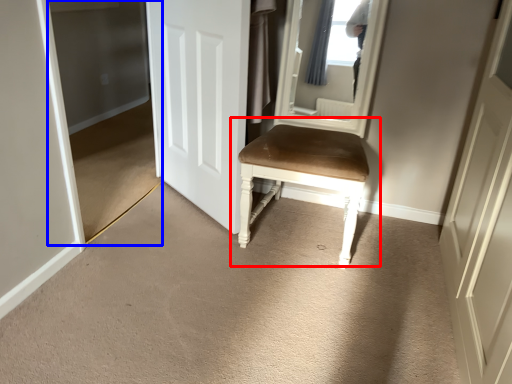
Question: Which point is further to the camera, chair (highlighted by a red box) or glass door (highlighted by a blue box)?

Choices:
 (A) chair
 (B) glass door

Answer: (B)